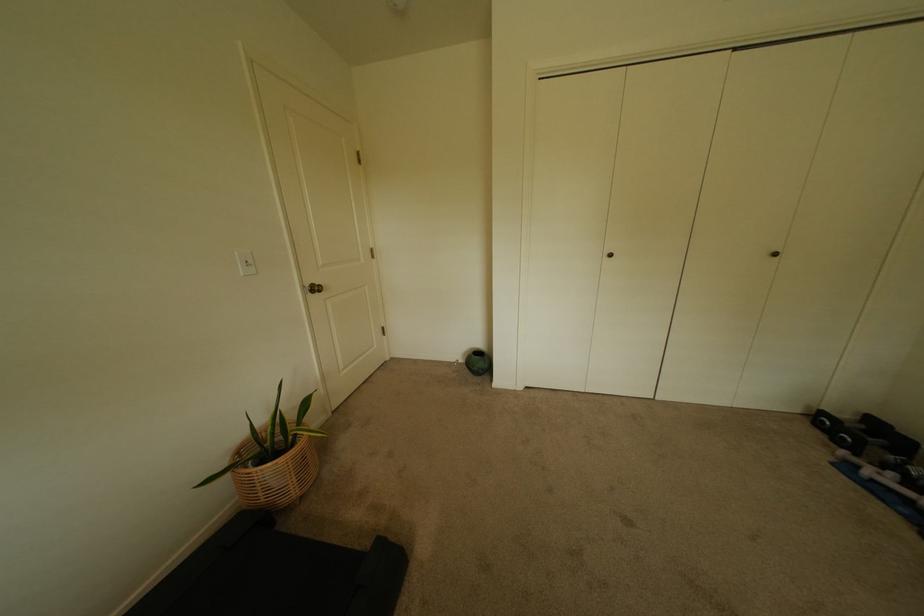
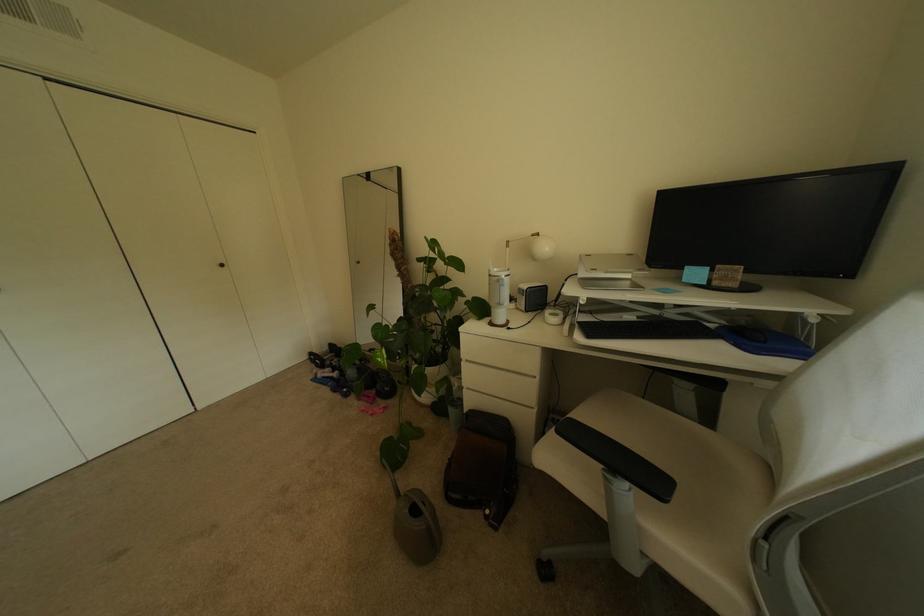
Question: The images are taken continuously from a first-person perspective. In which direction is your viewpoint rotating?

Choices:
 (A) Left
 (B) Right
 (C) Up
 (D) Down

Answer: (B)